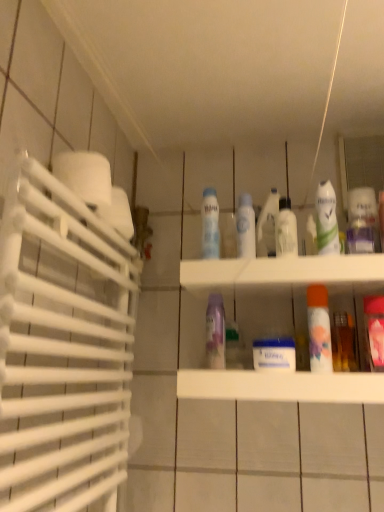
This screenshot has height=512, width=384. What do you see at coordinates (283, 275) in the screenshot?
I see `translucent plastic bottles at center` at bounding box center [283, 275].

The width and height of the screenshot is (384, 512). Identify the location of translucent plastic bottles at center. (x=283, y=275).

Describe the element at coordinates (215, 332) in the screenshot. I see `purple glossy spray can at center, the fourth cleaning product in the right-to-left sequence` at that location.

This screenshot has width=384, height=512. Describe the element at coordinates (245, 226) in the screenshot. I see `white glossy mouthwash at center, the 1th mouthwash when ordered from left to right` at that location.

What do you see at coordinates (326, 219) in the screenshot?
I see `white glossy deodorant at upper right, the fourth cleaning product viewed from the left` at bounding box center [326, 219].

The width and height of the screenshot is (384, 512). What are the coordinates of `pink glossy mouthwash at right, placed as the 4th mouthwash when sorted from left to right` in the screenshot? It's located at (374, 330).

Find the location of a particular element. This screenshot has height=512, width=384. translucent plastic bottles at center is located at coordinates (283, 275).

From the picture: Looking at their sizes, would you say white matte spray can at center, positioned as the 5th cleaning product in right-to-left order, is wider or thinner than translucent plastic spray bottle at center, the 3th cleaning product positioned from the left?

Considering their sizes, white matte spray can at center, positioned as the 5th cleaning product in right-to-left order, looks slimmer than translucent plastic spray bottle at center, the 3th cleaning product positioned from the left.

From a real-world perspective, who is located higher, white matte spray can at center, positioned as the 5th cleaning product in right-to-left order, or translucent plastic spray bottle at center, the 3th cleaning product viewed from the right?

translucent plastic spray bottle at center, the 3th cleaning product viewed from the right, from a real-world perspective.

Considering the relative positions of white matte spray can at center, positioned as the 5th cleaning product in right-to-left order, and translucent plastic spray bottle at center, the 3th cleaning product viewed from the right, in the image provided, is white matte spray can at center, positioned as the 5th cleaning product in right-to-left order, to the left of translucent plastic spray bottle at center, the 3th cleaning product viewed from the right, from the viewer's perspective?

Correct, you'll find white matte spray can at center, positioned as the 5th cleaning product in right-to-left order, to the left of translucent plastic spray bottle at center, the 3th cleaning product viewed from the right.

Could you measure the distance between white matte spray can at center, which ranks as the 1th cleaning product in left-to-right order, and translucent plastic spray bottle at center, the 3th cleaning product positioned from the left?

white matte spray can at center, which ranks as the 1th cleaning product in left-to-right order, and translucent plastic spray bottle at center, the 3th cleaning product positioned from the left, are 5.35 inches apart.

Is clear plastic bottle at center, the second mouthwash positioned from the left, far from purple glossy spray can at center, acting as the second cleaning product starting from the left?

Actually, clear plastic bottle at center, the second mouthwash positioned from the left, and purple glossy spray can at center, acting as the second cleaning product starting from the left, are a little close together.

Is clear plastic bottle at center, arranged as the 3th mouthwash when viewed from the right, facing away from purple glossy spray can at center, the fourth cleaning product in the right-to-left sequence?

clear plastic bottle at center, arranged as the 3th mouthwash when viewed from the right, is not turned away from purple glossy spray can at center, the fourth cleaning product in the right-to-left sequence.

Between clear plastic bottle at center, the second mouthwash positioned from the left, and purple glossy spray can at center, the fourth cleaning product in the right-to-left sequence, which one is positioned behind?

Positioned behind is clear plastic bottle at center, the second mouthwash positioned from the left.

Between point (285, 238) and point (208, 320), which one is positioned in front?

The point (208, 320) is more forward.

Which is in front, translucent plastic spray bottle at center, the 3th cleaning product viewed from the right, or white glossy mouthwash at center, the 1th mouthwash when ordered from left to right?

white glossy mouthwash at center, the 1th mouthwash when ordered from left to right, is closer to the camera.

Is translucent plastic spray bottle at center, the 3th cleaning product viewed from the right, at the left side of white glossy mouthwash at center, the 1th mouthwash when ordered from left to right?

In fact, translucent plastic spray bottle at center, the 3th cleaning product viewed from the right, is to the right of white glossy mouthwash at center, the 1th mouthwash when ordered from left to right.

Is translucent plastic spray bottle at center, the 3th cleaning product viewed from the right, thinner than white glossy mouthwash at center, the 1th mouthwash when ordered from left to right?

A: No.

Can you confirm if translucent plastic spray bottle at center, the 3th cleaning product positioned from the left, is smaller than white glossy mouthwash at center, the 1th mouthwash when ordered from left to right?

Incorrect, translucent plastic spray bottle at center, the 3th cleaning product positioned from the left, is not smaller in size than white glossy mouthwash at center, the 1th mouthwash when ordered from left to right.

From the image's perspective, is white matte spray can at center, which ranks as the 1th cleaning product in left-to-right order, located above or below white glossy deodorant at upper right, the fourth cleaning product viewed from the left?

white matte spray can at center, which ranks as the 1th cleaning product in left-to-right order, is below white glossy deodorant at upper right, the fourth cleaning product viewed from the left.

Is white matte spray can at center, positioned as the 5th cleaning product in right-to-left order, oriented towards white glossy deodorant at upper right, the fourth cleaning product viewed from the left?

No, white matte spray can at center, positioned as the 5th cleaning product in right-to-left order, is not turned towards white glossy deodorant at upper right, the fourth cleaning product viewed from the left.

Considering the sizes of objects white matte spray can at center, which ranks as the 1th cleaning product in left-to-right order, and white glossy deodorant at upper right, the fourth cleaning product viewed from the left, in the image provided, who is thinner, white matte spray can at center, which ranks as the 1th cleaning product in left-to-right order, or white glossy deodorant at upper right, the fourth cleaning product viewed from the left,?

Thinner between the two is white glossy deodorant at upper right, the fourth cleaning product viewed from the left.

What's the angular difference between white matte spray can at center, positioned as the 5th cleaning product in right-to-left order, and white glossy deodorant at upper right, the second cleaning product from the right,'s facing directions?

The angle between the facing direction of white matte spray can at center, positioned as the 5th cleaning product in right-to-left order, and the facing direction of white glossy deodorant at upper right, the second cleaning product from the right, is 0.00156 degrees.

From a real-world perspective, between translucent plastic spray can at upper right, marked as the first cleaning product in a right-to-left arrangement, and translucent plastic bottles at center, who is vertically higher?

From a 3D spatial view, translucent plastic spray can at upper right, marked as the first cleaning product in a right-to-left arrangement, is above.

Does point (372, 194) lie in front of point (341, 268)?

No, it is not.

Is translucent plastic spray can at upper right, acting as the 5th cleaning product starting from the left, directly adjacent to translucent plastic bottles at center?

No, translucent plastic spray can at upper right, acting as the 5th cleaning product starting from the left, is not next to translucent plastic bottles at center.

Is translucent plastic spray can at upper right, marked as the first cleaning product in a right-to-left arrangement, looking in the opposite direction of translucent plastic bottles at center?

No, translucent plastic spray can at upper right, marked as the first cleaning product in a right-to-left arrangement,'s orientation is not away from translucent plastic bottles at center.

Is white glossy deodorant at upper right, the fourth cleaning product viewed from the left, oriented towards purple glossy spray can at center, acting as the second cleaning product starting from the left?

No, white glossy deodorant at upper right, the fourth cleaning product viewed from the left, is not turned towards purple glossy spray can at center, acting as the second cleaning product starting from the left.

From a real-world perspective, which object stands above the other?

white glossy deodorant at upper right, the fourth cleaning product viewed from the left, from a real-world perspective.

Image resolution: width=384 pixels, height=512 pixels. What are the coordinates of `the 2nd cleaning product to the right when counting from the purple glossy spray can at center, acting as the second cleaning product starting from the left` in the screenshot? It's located at (326, 219).

Does point (318, 188) come behind point (214, 305)?

No, (318, 188) is closer to viewer.

Who is taller, pink glossy mouthwash at right, which ranks as the 1th mouthwash in right-to-left order, or white glossy mouthwash at center, marked as the 4th mouthwash in a right-to-left arrangement?

Standing taller between the two is pink glossy mouthwash at right, which ranks as the 1th mouthwash in right-to-left order.

Between pink glossy mouthwash at right, which ranks as the 1th mouthwash in right-to-left order, and white glossy mouthwash at center, marked as the 4th mouthwash in a right-to-left arrangement, which one appears on the right side from the viewer's perspective?

Positioned to the right is pink glossy mouthwash at right, which ranks as the 1th mouthwash in right-to-left order.

Would you say pink glossy mouthwash at right, placed as the 4th mouthwash when sorted from left to right, is inside or outside white glossy mouthwash at center, marked as the 4th mouthwash in a right-to-left arrangement?

pink glossy mouthwash at right, placed as the 4th mouthwash when sorted from left to right, lies outside white glossy mouthwash at center, marked as the 4th mouthwash in a right-to-left arrangement.

Is pink glossy mouthwash at right, placed as the 4th mouthwash when sorted from left to right, turned away from white glossy mouthwash at center, the 1th mouthwash when ordered from left to right?

No.

The width and height of the screenshot is (384, 512). What are the coordinates of `cleaning product that is the 1st object above the white matte spray can at center, positioned as the 5th cleaning product in right-to-left order (from a real-world perspective)` in the screenshot? It's located at (268, 225).

Locate an element on the screen. Image resolution: width=384 pixels, height=512 pixels. mouthwash that is the 3rd object located above the purple glossy spray can at center, the fourth cleaning product in the right-to-left sequence (from the image's perspective) is located at coordinates (286, 229).

In the scene shown: When comparing their distances from clear plastic bottle at center, arranged as the 3th mouthwash when viewed from the right, does translucent plastic spray can at upper right, marked as the first cleaning product in a right-to-left arrangement, or purple glossy spray can at center, acting as the second cleaning product starting from the left, seem further?

purple glossy spray can at center, acting as the second cleaning product starting from the left.

When comparing their distances from translucent plastic bottles at center, does white glossy deodorant at upper right, the second cleaning product from the right, or white matte spray can at center, positioned as the 5th cleaning product in right-to-left order, seem further?

Based on the image, white matte spray can at center, positioned as the 5th cleaning product in right-to-left order, appears to be further to translucent plastic bottles at center.

Based on their spatial positions, is purple glossy spray can at center, acting as the second cleaning product starting from the left, or white matte toilet paper at left further from white glossy deodorant at upper right, the second cleaning product from the right?

Among the two, white matte toilet paper at left is located further to white glossy deodorant at upper right, the second cleaning product from the right.

When comparing their distances from pink glossy mouthwash at right, placed as the 4th mouthwash when sorted from left to right, does translucent plastic spray bottle at center, the 3th cleaning product positioned from the left, or clear plastic bottle at center, arranged as the 3th mouthwash when viewed from the right, seem further?

The object further to pink glossy mouthwash at right, placed as the 4th mouthwash when sorted from left to right, is translucent plastic spray bottle at center, the 3th cleaning product positioned from the left.

Considering their positions, is translucent plastic spray bottle at center, the 3th cleaning product positioned from the left, positioned further to purple glossy spray can at center, the fourth cleaning product in the right-to-left sequence, than clear plastic bottle at center, the second mouthwash positioned from the left?

clear plastic bottle at center, the second mouthwash positioned from the left, lies further to purple glossy spray can at center, the fourth cleaning product in the right-to-left sequence, than the other object.

When comparing their distances from clear plastic bottle at center, the second mouthwash positioned from the left, does orange matte mouthwash at center-right, placed as the 3th mouthwash when sorted from left to right, or translucent plastic bottles at center seem closer?

orange matte mouthwash at center-right, placed as the 3th mouthwash when sorted from left to right, is closer to clear plastic bottle at center, the second mouthwash positioned from the left.

Looking at the image, which one is located closer to pink glossy mouthwash at right, which ranks as the 1th mouthwash in right-to-left order, white glossy mouthwash at center, marked as the 4th mouthwash in a right-to-left arrangement, or clear plastic bottle at center, arranged as the 3th mouthwash when viewed from the right?

clear plastic bottle at center, arranged as the 3th mouthwash when viewed from the right, lies closer to pink glossy mouthwash at right, which ranks as the 1th mouthwash in right-to-left order, than the other object.

Estimate the real-world distances between objects in this image. Which object is further from white glossy mouthwash at center, the 1th mouthwash when ordered from left to right, translucent plastic spray can at upper right, acting as the 5th cleaning product starting from the left, or translucent plastic bottles at center?

translucent plastic spray can at upper right, acting as the 5th cleaning product starting from the left, lies further to white glossy mouthwash at center, the 1th mouthwash when ordered from left to right, than the other object.

At what (x,y) coordinates should I click in order to perform the action: click on mouthwash between white matte toilet paper at left and translucent plastic spray bottle at center, the 3th cleaning product viewed from the right, in the horizontal direction. Please return your answer as a coordinate pair (x, y). Looking at the image, I should click on (245, 226).

Find the location of a particular element. cleaning product between clear plastic bottle at center, the second mouthwash positioned from the left, and translucent plastic bottles at center from top to bottom is located at coordinates (215, 332).

The height and width of the screenshot is (512, 384). In order to click on shelf situated between white glossy mouthwash at center, the 1th mouthwash when ordered from left to right, and translucent plastic spray can at upper right, acting as the 5th cleaning product starting from the left, from left to right in this screenshot , I will do `click(283, 275)`.

Where is `shelf situated between white matte spray can at center, which ranks as the 1th cleaning product in left-to-right order, and translucent plastic spray can at upper right, marked as the first cleaning product in a right-to-left arrangement, from left to right`? The width and height of the screenshot is (384, 512). shelf situated between white matte spray can at center, which ranks as the 1th cleaning product in left-to-right order, and translucent plastic spray can at upper right, marked as the first cleaning product in a right-to-left arrangement, from left to right is located at coordinates (283, 275).